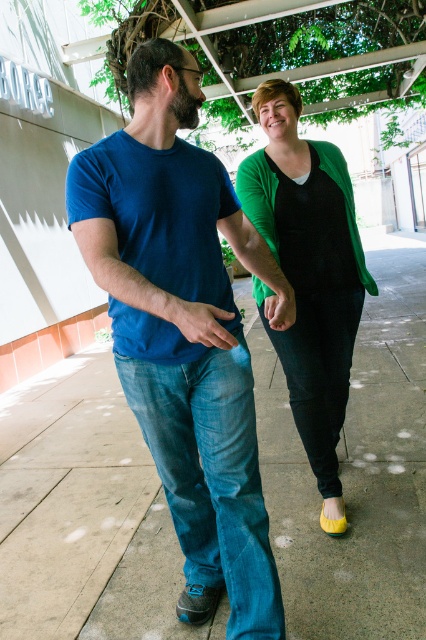
You are standing in the same location as the two people in the image. Which object, the smooth concrete pavement at center or the matte blue jeans at center, is closer to you?

The matte blue jeans at center are closer to you because the smooth concrete pavement at center is further away.

You are standing at the origin of the coordinate system in the image. The blue denim jeans at left is located at point [181,332]. If you walk straight towards the blue denim jeans at left, which direction should you face? Please answer with either north, south, east, or west.

The point [181,332] corresponds to blue denim jeans at left. To face the direction towards this point from the origin, you should face east.